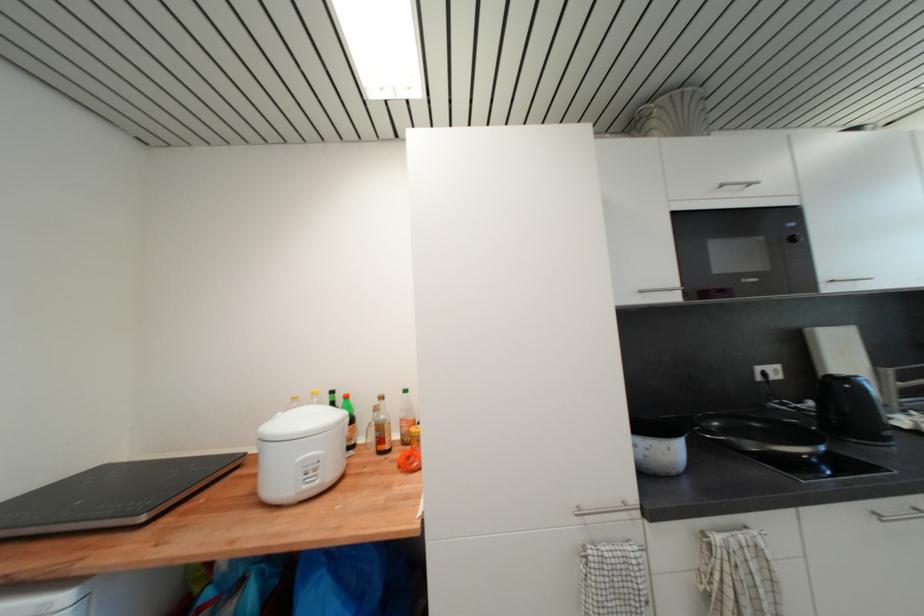
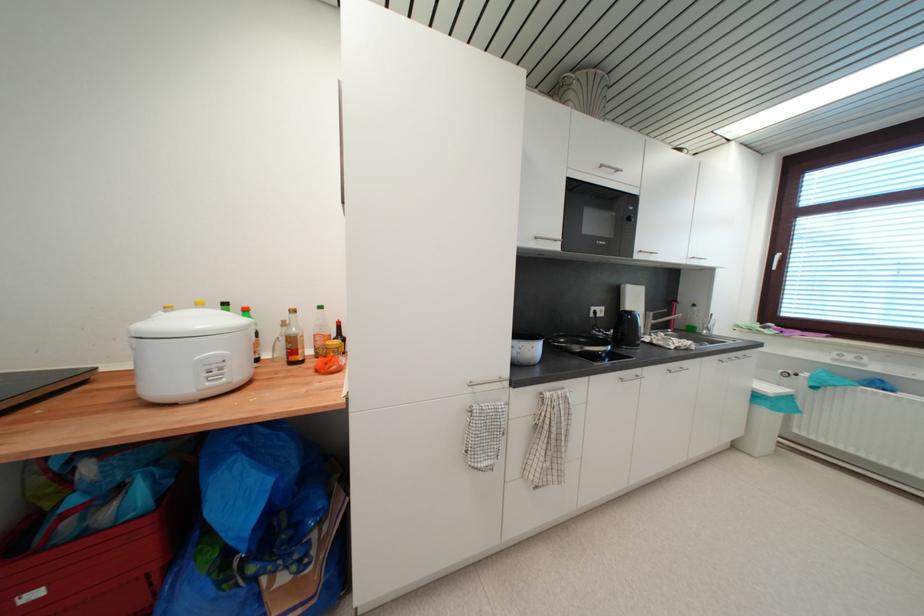
Question: I am providing you with two images of the same scene from different viewpoints. Please identify which objects are invisible in image2.

Choices:
 (A) woven basket
 (B) white cooking pot
 (C) black kettle handle
 (D) none of these

Answer: (D)